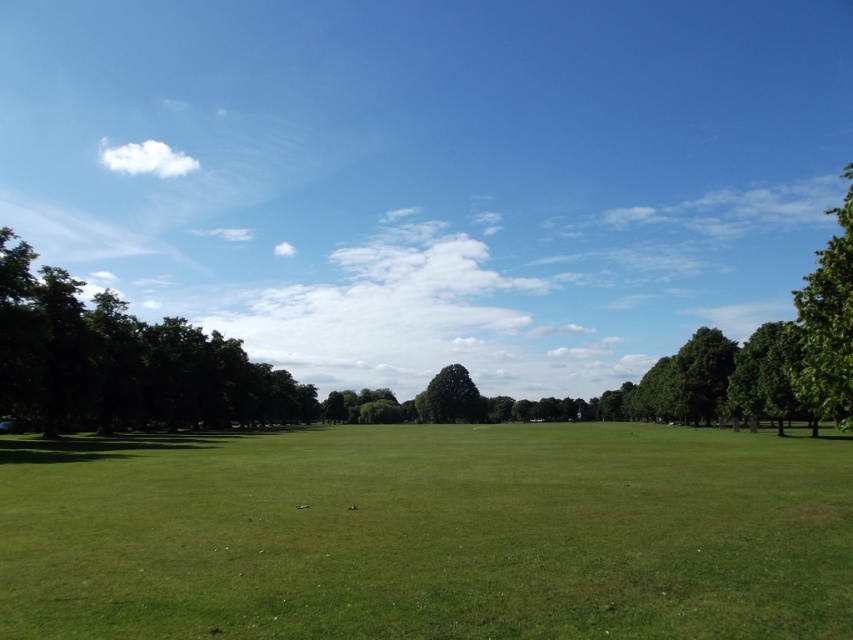
You are a park visitor standing in the foreground grass. You want to take a photo of both the green leafy tree at left and the green leafy tree at center. Which tree should you stand closer to in order to include both in your camera frame?

To include both the green leafy tree at left and the green leafy tree at center in your camera frame, you should stand closer to the green leafy tree at center because the green leafy tree at left is located above it, meaning it is further away from you. By positioning yourself nearer to the closer tree, you can better capture both within the same shot.

You are planning to place a large picnic blanket on the green grass at center and under the green leafy tree at left. Based on their sizes, which area would be more suitable for the blanket?

The green leafy tree at left is larger than the green grass at center, so placing the picnic blanket under the green leafy tree at left would provide more space for the blanket.

You are a gardener who wants to mow the lawn. You have a lawnmower that can only cut grass shorter than 10 cm. Based on the scene, can you safely mow the green grass at center without damaging the green leafy tree at left?

The green grass at center is shorter than the green leafy tree at left, but the exact height of the grass is not provided. Without knowing the specific height of the grass, it is impossible to determine if it is under 10 cm. Therefore, you cannot safely mow the green grass at center based on the given information.